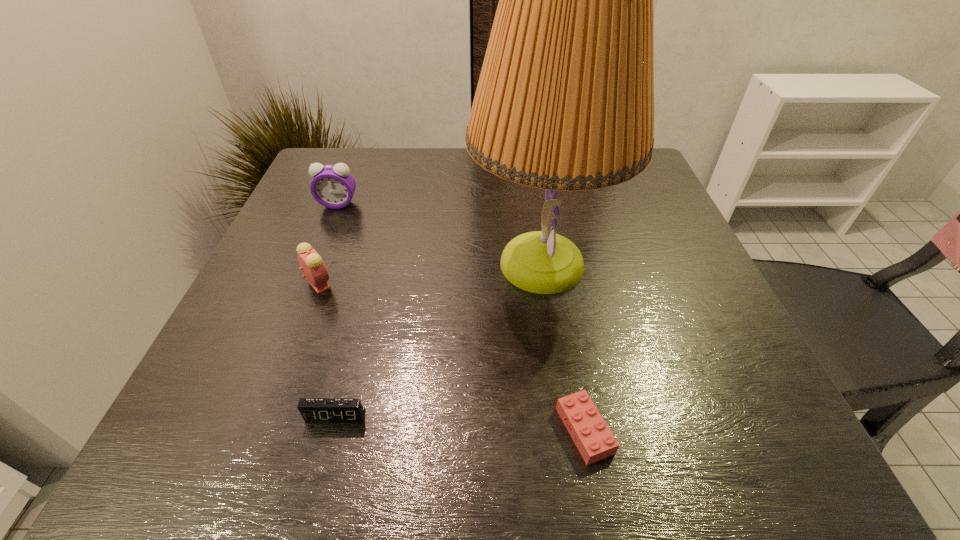
You are a GUI agent. You are given a task and a screenshot of the screen. Output one action in this format:
    pyautogui.click(x=<x>, y=<y>)
    Task: Click on the vacant area that lies between the Lego and the second tallest alarm clock
    
    Given the screenshot: What is the action you would take?
    pyautogui.click(x=451, y=357)

Find the location of a particular element. This screenshot has width=960, height=540. free space between the farthest object and the second farthest alarm clock is located at coordinates (328, 244).

Where is `vacant region between the lamp and the third object from left to right`? The height and width of the screenshot is (540, 960). vacant region between the lamp and the third object from left to right is located at coordinates (439, 340).

Image resolution: width=960 pixels, height=540 pixels. Identify the location of object that ranks as the third closest to the farthest object. (311, 409).

I want to click on the fourth closest object to the second shortest object, so click(333, 186).

Choose which alarm clock is the nearest neighbor to the lamp. Please provide its 2D coordinates. Your answer should be formatted as a tuple, i.e. [(x, y)], where the tuple contains the x and y coordinates of a point satisfying the conditions above.

[(311, 409)]

Point out which alarm clock is positioned as the nearest to the farthest alarm clock. Please provide its 2D coordinates. Your answer should be formatted as a tuple, i.e. [(x, y)], where the tuple contains the x and y coordinates of a point satisfying the conditions above.

[(311, 263)]

You are a GUI agent. You are given a task and a screenshot of the screen. Output one action in this format:
    pyautogui.click(x=<x>, y=<y>)
    Task: Click on the free location that satisfies the following two spatial constraints: 1. on the face of the Lego; 2. on the left side of the third tallest object
    
    Given the screenshot: What is the action you would take?
    pyautogui.click(x=264, y=430)

Locate an element on the screen. This screenshot has width=960, height=540. vacant area that satisfies the following two spatial constraints: 1. on the side of the lamp near the pull switch; 2. on the front-facing side of the second shortest object is located at coordinates (564, 416).

Where is `free spot that satisfies the following two spatial constraints: 1. on the front-facing side of the shortest object; 2. on the right side of the third object from left to right`? This screenshot has height=540, width=960. free spot that satisfies the following two spatial constraints: 1. on the front-facing side of the shortest object; 2. on the right side of the third object from left to right is located at coordinates (331, 430).